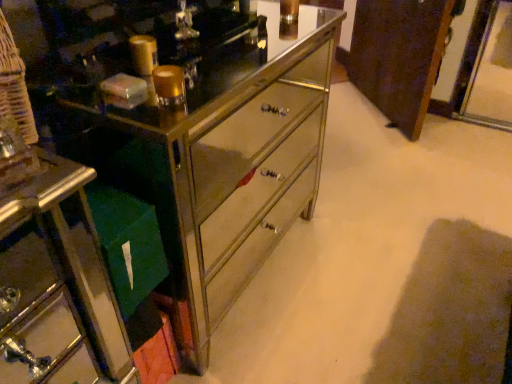
Question: Is brown wood cabinet at center far from green fabric bag at lower left?

Choices:
 (A) no
 (B) yes

Answer: (B)

Question: Can you confirm if brown wood cabinet at center is wider than green fabric bag at lower left?

Choices:
 (A) yes
 (B) no

Answer: (A)

Question: From the image's perspective, is brown wood cabinet at center under green fabric bag at lower left?

Choices:
 (A) yes
 (B) no

Answer: (B)

Question: Is brown wood cabinet at center shorter than green fabric bag at lower left?

Choices:
 (A) no
 (B) yes

Answer: (A)

Question: Can you confirm if brown wood cabinet at center is smaller than green fabric bag at lower left?

Choices:
 (A) yes
 (B) no

Answer: (B)

Question: Does brown wood cabinet at center appear on the left side of green fabric bag at lower left?

Choices:
 (A) yes
 (B) no

Answer: (B)

Question: Is brown wood cabinet at center shorter than metallic mirrored chest of drawers at center?

Choices:
 (A) no
 (B) yes

Answer: (B)

Question: Is brown wood cabinet at center to the left of metallic mirrored chest of drawers at center from the viewer's perspective?

Choices:
 (A) no
 (B) yes

Answer: (A)

Question: Can you see brown wood cabinet at center touching metallic mirrored chest of drawers at center?

Choices:
 (A) yes
 (B) no

Answer: (B)

Question: Is brown wood cabinet at center turned away from metallic mirrored chest of drawers at center?

Choices:
 (A) no
 (B) yes

Answer: (A)

Question: Is brown wood cabinet at center further to camera compared to metallic mirrored chest of drawers at center?

Choices:
 (A) yes
 (B) no

Answer: (A)

Question: Is metallic mirrored chest of drawers at center a part of brown wood cabinet at center?

Choices:
 (A) yes
 (B) no

Answer: (B)

Question: Is metallic mirrored chest of drawers at center completely or partially outside of green fabric bag at lower left?

Choices:
 (A) no
 (B) yes

Answer: (B)